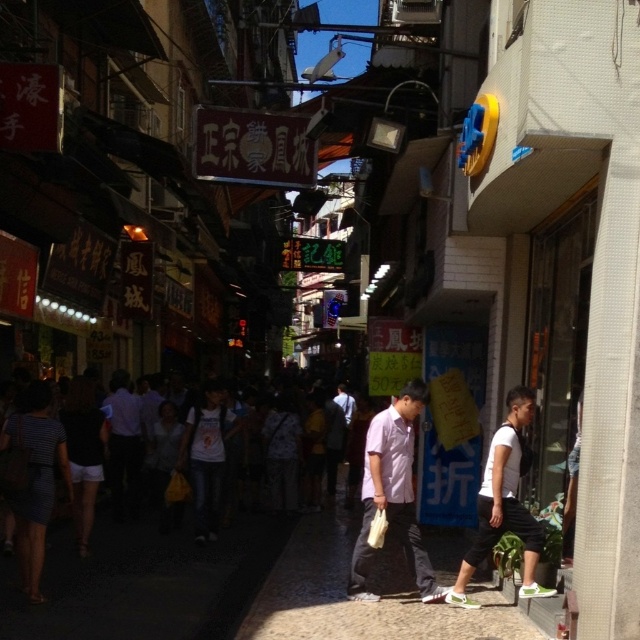
This screenshot has height=640, width=640. What do you see at coordinates (392, 493) in the screenshot?
I see `matte white shirt at center` at bounding box center [392, 493].

Can you confirm if matte white shirt at center is wider than white matte shirt at center?

Indeed, matte white shirt at center has a greater width compared to white matte shirt at center.

Locate an element on the screen. The height and width of the screenshot is (640, 640). matte white shirt at center is located at coordinates (392, 493).

Is smooth concrete pavement at center further to the viewer compared to white matte shirt at center?

No, smooth concrete pavement at center is in front of white matte shirt at center.

Which is behind, point (330, 582) or point (486, 508)?

Point (330, 582)

Who is more forward, (388, 588) or (477, 516)?

Point (477, 516) is in front.

I want to click on smooth concrete pavement at center, so click(364, 604).

What do you see at coordinates (163, 564) in the screenshot? The image size is (640, 640). I see `dark gray clothing at center` at bounding box center [163, 564].

Can you confirm if dark gray clothing at center is positioned above white matte shirt at center?

Incorrect, dark gray clothing at center is not positioned above white matte shirt at center.

Between point (124, 547) and point (520, 392), which one is positioned in front?

Point (520, 392) is more forward.

Find the location of a particular element. Image resolution: width=640 pixels, height=640 pixels. dark gray clothing at center is located at coordinates tap(163, 564).